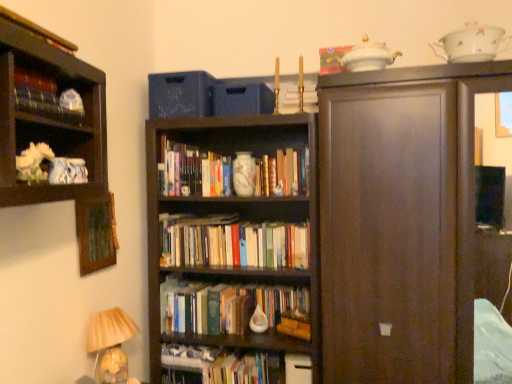
Locate an element on the screen. Image resolution: width=512 pixels, height=384 pixels. wooden picture frame at upper left is located at coordinates click(96, 233).

This screenshot has height=384, width=512. What do you see at coordinates (96, 233) in the screenshot? I see `wooden picture frame at upper left` at bounding box center [96, 233].

Where is `wooden picture frame at upper left`? Image resolution: width=512 pixels, height=384 pixels. wooden picture frame at upper left is located at coordinates (96, 233).

Is translucent glass lampshade at lower left outside of matte black book at upper left, positioned as the second book in top-to-bottom order?

That's correct, translucent glass lampshade at lower left is outside of matte black book at upper left, positioned as the second book in top-to-bottom order.

Are translucent glass lampshade at lower left and matte black book at upper left, the 4th book from the back, beside each other?

translucent glass lampshade at lower left and matte black book at upper left, the 4th book from the back, are not in contact.

From a real-world perspective, between translucent glass lampshade at lower left and matte black book at upper left, the 4th book from the back, who is vertically higher?

matte black book at upper left, the 4th book from the back, from a real-world perspective.

Which is behind, point (105, 374) or point (53, 88)?

The point (105, 374) is farther.

Is matte black book at upper left, arranged as the 3th book when ordered from the bottom, wider than dark wood cupboard at right?

No, matte black book at upper left, arranged as the 3th book when ordered from the bottom, is not wider than dark wood cupboard at right.

Considering the sizes of objects matte black book at upper left, placed as the 1th book when sorted from left to right, and dark wood cupboard at right in the image provided, who is taller, matte black book at upper left, placed as the 1th book when sorted from left to right, or dark wood cupboard at right?

dark wood cupboard at right is taller.

Looking at this image, can you confirm if matte black book at upper left, the 4th book from the back, is positioned to the left of dark wood cupboard at right?

Yes, matte black book at upper left, the 4th book from the back, is to the left of dark wood cupboard at right.

Is matte black book at upper left, arranged as the 3th book when ordered from the bottom, spatially inside dark wood cupboard at right, or outside of it?

matte black book at upper left, arranged as the 3th book when ordered from the bottom, lies outside dark wood cupboard at right.

Is point (195, 102) less distant than point (42, 96)?

No, it is not.

Identify the location of book that is the 2nd object directly below the blue textured baskets at upper center (from a real-world perspective). (46, 98).

Are blue textured baskets at upper center and matte black book at upper left, placed as the 1th book when sorted from left to right, located far from each other?

They are positioned close to each other.

Considering the positions of objects white paper book at center, the 3th book when ordered from left to right, and dark wood cupboard at right in the image provided, who is more to the right, white paper book at center, the 3th book when ordered from left to right, or dark wood cupboard at right?

From the viewer's perspective, dark wood cupboard at right appears more on the right side.

Is white paper book at center, the second book from the front, taller or shorter than dark wood cupboard at right?

Considering their sizes, white paper book at center, the second book from the front, has less height than dark wood cupboard at right.

Does point (305, 234) appear closer or farther from the camera than point (372, 333)?

Clearly, point (305, 234) is more distant from the camera than point (372, 333).

Looking at the image, does white paper book at center, the first book positioned from the bottom, seem bigger or smaller compared to dark wood cupboard at right?

white paper book at center, the first book positioned from the bottom, is smaller than dark wood cupboard at right.

Is gold metallic candlestick at upper center, which is counted as the 4th book, starting from the left, positioned behind hardcover books at center, the 3th book in the top-to-bottom sequence?

That is False.

Consider the image. Is the surface of gold metallic candlestick at upper center, the third book positioned from the front, in direct contact with hardcover books at center, the 1th book in the back-to-front sequence?

No.

Between gold metallic candlestick at upper center, the 2th book in the back-to-front sequence, and hardcover books at center, which ranks as the 3th book in right-to-left order, which one has less height?

gold metallic candlestick at upper center, the 2th book in the back-to-front sequence, is shorter.

In the scene shown: Does gold metallic candlestick at upper center, the 2th book in the back-to-front sequence, contain hardcover books at center, the 1th book in the back-to-front sequence?

No, hardcover books at center, the 1th book in the back-to-front sequence, is not surrounded by gold metallic candlestick at upper center, the 2th book in the back-to-front sequence.

Is translucent glass lampshade at lower left in front of or behind dark wood cupboard at right in the image?

translucent glass lampshade at lower left is positioned farther from the viewer than dark wood cupboard at right.

Is translucent glass lampshade at lower left aimed at dark wood cupboard at right?

Yes.

Considering the relative sizes of translucent glass lampshade at lower left and dark wood cupboard at right in the image provided, is translucent glass lampshade at lower left shorter than dark wood cupboard at right?

Yes, translucent glass lampshade at lower left is shorter than dark wood cupboard at right.

Between translucent glass lampshade at lower left and dark wood cupboard at right, which one has larger width?

dark wood cupboard at right.

Does translucent glass lampshade at lower left touch hardcover book at center?

No.

Can you confirm if translucent glass lampshade at lower left is smaller than hardcover book at center?

No, translucent glass lampshade at lower left is not smaller than hardcover book at center.

Is translucent glass lampshade at lower left turned away from hardcover book at center?

No.

Is translucent glass lampshade at lower left inside or outside of hardcover book at center?

translucent glass lampshade at lower left lies outside hardcover book at center.

Where is `book lying on the left of translucent glass lampshade at lower left`? book lying on the left of translucent glass lampshade at lower left is located at coordinates (46, 98).

There is a dark wood cupboard at right. Where is `the 2nd book above it (from the image's perspective)`? the 2nd book above it (from the image's perspective) is located at coordinates (46, 98).

Which object lies nearer to the anchor point matte black book at upper left, the 1th book from the front, gold metallic candlestick at upper center, which is the first book from right to left, or blue textured baskets at upper center?

blue textured baskets at upper center.

Based on their spatial positions, is hardcover books at center, which ranks as the 3th book in right-to-left order, or translucent glass lampshade at lower left closer to hardcover book at center?

translucent glass lampshade at lower left is positioned closer to the anchor hardcover book at center.

Looking at the image, which one is located further to hardcover books at center, marked as the 2th book in a left-to-right arrangement, hardcover book at center or gold metallic candlestick at upper center, which is the first book from right to left?

Based on the image, hardcover book at center appears to be further to hardcover books at center, marked as the 2th book in a left-to-right arrangement.

Looking at the image, which one is located further to matte black book at upper left, the 1th book from the front, translucent glass lampshade at lower left or blue textured baskets at upper center?

translucent glass lampshade at lower left.

Looking at the image, which one is located closer to dark wood cupboard at right, matte black book at upper left, the 1th book from the front, or blue textured baskets at upper center?

The object closer to dark wood cupboard at right is blue textured baskets at upper center.

From the image, which object appears to be farther from wooden picture frame at upper left, blue textured baskets at upper center or translucent glass lampshade at lower left?

blue textured baskets at upper center is positioned further to the anchor wooden picture frame at upper left.

When comparing their distances from white paper book at center, which is the 4th book in top-to-bottom order, does translucent glass lampshade at lower left or hardcover books at center, the 3th book in the top-to-bottom sequence, seem further?

translucent glass lampshade at lower left is further to white paper book at center, which is the 4th book in top-to-bottom order.

From the image, which object appears to be farther from gold metallic candlestick at upper center, marked as the 4th book in a bottom-to-top arrangement, wooden picture frame at upper left or white paper book at center, the second book from the front?

Among the two, wooden picture frame at upper left is located further to gold metallic candlestick at upper center, marked as the 4th book in a bottom-to-top arrangement.

Locate an element on the screen. This screenshot has height=384, width=512. cupboard between hardcover books at center, the 3th book in the top-to-bottom sequence, and hardcover book at center from top to bottom is located at coordinates (404, 223).

This screenshot has height=384, width=512. Find the location of `picture frame between matte black book at upper left, positioned as the second book in top-to-bottom order, and translucent glass lampshade at lower left vertically`. picture frame between matte black book at upper left, positioned as the second book in top-to-bottom order, and translucent glass lampshade at lower left vertically is located at coordinates (96, 233).

Image resolution: width=512 pixels, height=384 pixels. I want to click on book that lies between hardcover books at center, acting as the fourth book starting from the front, and translucent glass lampshade at lower left from top to bottom, so click(233, 242).

What are the coordinates of `cabinetry between hardcover books at center, which ranks as the second book in bottom-to-top order, and gold metallic candlestick at upper center, marked as the 4th book in a bottom-to-top arrangement` in the screenshot? It's located at (180, 94).